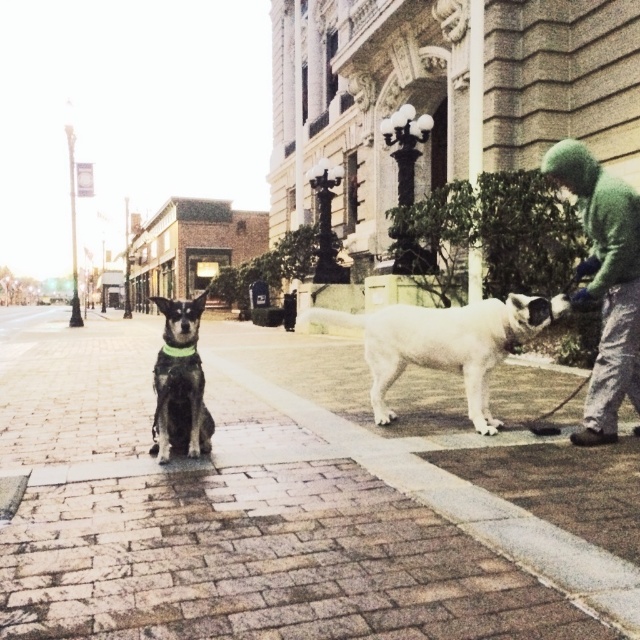
Is white fur dog at right smaller than green fabric neckband at center?

Incorrect, white fur dog at right is not smaller in size than green fabric neckband at center.

Is white fur dog at right positioned in front of green fabric neckband at center?

No, it is behind green fabric neckband at center.

This screenshot has width=640, height=640. Describe the element at coordinates (444, 342) in the screenshot. I see `white fur dog at right` at that location.

Locate an element on the screen. The width and height of the screenshot is (640, 640). white fur dog at right is located at coordinates (444, 342).

Based on the photo, who is taller, green fuzzy sweater at right or white fur dog at right?

Standing taller between the two is green fuzzy sweater at right.

Is point (595, 413) farther from camera compared to point (371, 320)?

No, it is in front of (371, 320).

This screenshot has width=640, height=640. I want to click on green fuzzy sweater at right, so (604, 282).

Is brick pavement at center taller than green fuzzy sweater at right?

No.

Is brick pavement at center bigger than green fuzzy sweater at right?

Indeed, brick pavement at center has a larger size compared to green fuzzy sweater at right.

Is point (168, 522) behind point (579, 433)?

No, it is not.

The height and width of the screenshot is (640, 640). Identify the location of brick pavement at center. pos(294,500).